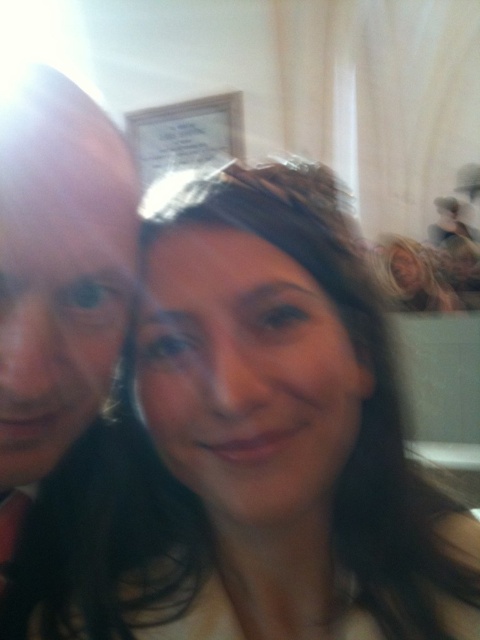
You are a photographer adjusting the lighting for a group photo. You notice two people in the frame with dark brown hair at center and matte black hair at left. Which person has hair that reaches lower on their neck?

The matte black hair at left reaches lower on the neck because it is longer than the dark brown hair at center.

You are taking a selfie and want to ensure that the point at coordinate point (70, 358) is in focus. What is the minimum distance you need to maintain between the camera and the point to achieve this?

The point at coordinate point (70, 358) is 15.80 inches from the camera, so you need to maintain a distance of at least 15.80 inches to ensure it stays in focus.

You are taking a selfie and want to ensure the blonde hair at upper right is centered in the frame. Given its current coordinates, what adjustment should you make to the camera position?

The blonde hair at upper right is currently at coordinates point (x=415, y=275). To center it, move the camera slightly to the left and down so the hair moves towards the center of the frame.